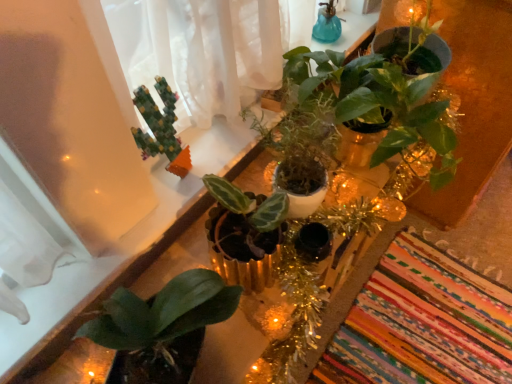
Describe the element at coordinates (384, 93) in the screenshot. I see `green matte plant at upper center, placed as the 1th houseplant when sorted from right to left` at that location.

Identify the location of blue glass vase at upper center. The height and width of the screenshot is (384, 512). (327, 28).

The width and height of the screenshot is (512, 384). Find the location of `green mosaic cactus at upper left, placed as the first houseplant when sorted from left to right`. green mosaic cactus at upper left, placed as the first houseplant when sorted from left to right is located at coordinates (160, 128).

Describe the element at coordinates (344, 124) in the screenshot. I see `green matte plant at center` at that location.

Find the location of `green matte plant at center, which appears as the second houseplant when viewed from the left`. green matte plant at center, which appears as the second houseplant when viewed from the left is located at coordinates (305, 128).

Is blue glass vase at upper center next to multicolored woven mat at lower right and touching it?

They are not placed beside each other.

Could you tell me if blue glass vase at upper center is facing multicolored woven mat at lower right?

No, blue glass vase at upper center is not turned towards multicolored woven mat at lower right.

From a real-world perspective, is blue glass vase at upper center under multicolored woven mat at lower right?

No, from a real-world perspective, blue glass vase at upper center is not beneath multicolored woven mat at lower right.

The image size is (512, 384). Find the location of `mat that appears below the blue glass vase at upper center (from a real-world perspective)`. mat that appears below the blue glass vase at upper center (from a real-world perspective) is located at coordinates (422, 324).

Consider the image. Is green matte plant at upper center, placed as the 1th houseplant when sorted from right to left, closer to the viewer compared to blue glass vase at upper center?

That is True.

Can you confirm if green matte plant at upper center, placed as the 1th houseplant when sorted from right to left, is thinner than blue glass vase at upper center?

No, green matte plant at upper center, placed as the 1th houseplant when sorted from right to left, is not thinner than blue glass vase at upper center.

Can you confirm if green matte plant at upper center, the 3th houseplant in the left-to-right sequence, is bigger than blue glass vase at upper center?

Yes.

Is blue glass vase at upper center smaller than green matte plant at center, the 2th houseplant positioned from the right?

Indeed, blue glass vase at upper center has a smaller size compared to green matte plant at center, the 2th houseplant positioned from the right.

From a real-world perspective, is blue glass vase at upper center on green matte plant at center, the 2th houseplant positioned from the right?

Yes, from a real-world perspective, blue glass vase at upper center is on top of green matte plant at center, the 2th houseplant positioned from the right.

Is blue glass vase at upper center wider or thinner than green matte plant at center, which appears as the second houseplant when viewed from the left?

Clearly, blue glass vase at upper center has less width compared to green matte plant at center, which appears as the second houseplant when viewed from the left.

Based on the photo, is green matte plant at center, the 2th houseplant positioned from the right, completely or partially inside blue glass vase at upper center?

No, green matte plant at center, the 2th houseplant positioned from the right, is not a part of blue glass vase at upper center.

Is green mosaic cactus at upper left, placed as the first houseplant when sorted from left to right, further to the viewer compared to green matte plant at center, which appears as the second houseplant when viewed from the left?

Yes, it is behind green matte plant at center, which appears as the second houseplant when viewed from the left.

Is green mosaic cactus at upper left, positioned as the third houseplant in right-to-left order, directly adjacent to green matte plant at center, the 2th houseplant positioned from the right?

They are not placed beside each other.

Based on the photo, is multicolored woven mat at lower right with blue glass vase at upper center?

No, multicolored woven mat at lower right is not in contact with blue glass vase at upper center.

Considering the points (420, 286) and (329, 36), which point is in front, point (420, 286) or point (329, 36)?

The point (329, 36) is more forward.

Is multicolored woven mat at lower right taller or shorter than blue glass vase at upper center?

multicolored woven mat at lower right is shorter than blue glass vase at upper center.

Considering the relative sizes of multicolored woven mat at lower right and blue glass vase at upper center in the image provided, is multicolored woven mat at lower right wider than blue glass vase at upper center?

Yes, multicolored woven mat at lower right is wider than blue glass vase at upper center.

Identify the location of mat that is on the right side of green mosaic cactus at upper left, placed as the first houseplant when sorted from left to right. (422, 324).

Is green mosaic cactus at upper left, placed as the first houseplant when sorted from left to right, turned away from multicolored woven mat at lower right?

No, green mosaic cactus at upper left, placed as the first houseplant when sorted from left to right, is not facing the opposite direction of multicolored woven mat at lower right.

Consider the image. Is green mosaic cactus at upper left, positioned as the third houseplant in right-to-left order, positioned before multicolored woven mat at lower right?

Yes, it is.

From the image's perspective, which is above, green mosaic cactus at upper left, placed as the first houseplant when sorted from left to right, or multicolored woven mat at lower right?

green mosaic cactus at upper left, placed as the first houseplant when sorted from left to right, appears higher in the image.

Is green matte plant at center further to the viewer compared to blue glass vase at upper center?

No, it is in front of blue glass vase at upper center.

Are green matte plant at center and blue glass vase at upper center far apart?

No, green matte plant at center is not far from blue glass vase at upper center.

Is green matte plant at center positioned with its back to blue glass vase at upper center?

No, green matte plant at center is not facing away from blue glass vase at upper center.

From the image's perspective, which one is positioned lower, green matte plant at center or blue glass vase at upper center?

green matte plant at center.

Identify the location of glass vase that is on the left side of multicolored woven mat at lower right. (327, 28).

Locate an element on the screen. Image resolution: width=512 pixels, height=384 pixels. glass vase above the green matte plant at upper center, placed as the 1th houseplant when sorted from right to left (from a real-world perspective) is located at coordinates (327, 28).

Looking at the image, which one is located closer to multicolored woven mat at lower right, blue glass vase at upper center or green matte plant at upper center, the 3th houseplant in the left-to-right sequence?

green matte plant at upper center, the 3th houseplant in the left-to-right sequence, is closer to multicolored woven mat at lower right.

When comparing their distances from green matte plant at center, does green mosaic cactus at upper left, placed as the first houseplant when sorted from left to right, or multicolored woven mat at lower right seem closer?

green mosaic cactus at upper left, placed as the first houseplant when sorted from left to right, is closer to green matte plant at center.

Which object lies nearer to the anchor point green matte plant at upper center, placed as the 1th houseplant when sorted from right to left, green mosaic cactus at upper left, positioned as the third houseplant in right-to-left order, or blue glass vase at upper center?

blue glass vase at upper center is closer to green matte plant at upper center, placed as the 1th houseplant when sorted from right to left.

Estimate the real-world distances between objects in this image. Which object is closer to green matte plant at upper center, the 3th houseplant in the left-to-right sequence, multicolored woven mat at lower right or blue glass vase at upper center?

Among the two, blue glass vase at upper center is located nearer to green matte plant at upper center, the 3th houseplant in the left-to-right sequence.

Looking at the image, which one is located closer to green matte plant at upper center, the 3th houseplant in the left-to-right sequence, multicolored woven mat at lower right or green matte plant at center, the 2th houseplant positioned from the right?

green matte plant at center, the 2th houseplant positioned from the right, lies closer to green matte plant at upper center, the 3th houseplant in the left-to-right sequence, than the other object.

Looking at this image, looking at the image, which one is located closer to blue glass vase at upper center, green matte plant at upper center, placed as the 1th houseplant when sorted from right to left, or green matte plant at center, the 2th houseplant positioned from the right?

The object closer to blue glass vase at upper center is green matte plant at upper center, placed as the 1th houseplant when sorted from right to left.

When comparing their distances from blue glass vase at upper center, does green matte plant at upper center, the 3th houseplant in the left-to-right sequence, or green mosaic cactus at upper left, positioned as the third houseplant in right-to-left order, seem further?

green mosaic cactus at upper left, positioned as the third houseplant in right-to-left order, is further to blue glass vase at upper center.

Looking at the image, which one is located further to blue glass vase at upper center, green matte plant at center, the 2th houseplant positioned from the right, or green matte plant at upper center, the 3th houseplant in the left-to-right sequence?

The object further to blue glass vase at upper center is green matte plant at center, the 2th houseplant positioned from the right.

Where is `houseplant between green mosaic cactus at upper left, placed as the first houseplant when sorted from left to right, and green matte plant at center`? The width and height of the screenshot is (512, 384). houseplant between green mosaic cactus at upper left, placed as the first houseplant when sorted from left to right, and green matte plant at center is located at coordinates (305, 128).

You are a GUI agent. You are given a task and a screenshot of the screen. Output one action in this format:
    pyautogui.click(x=<x>, y=<y>)
    Task: Click on the floral arrangement between green matte plant at center, which appears as the second houseplant when viewed from the left, and multicolored woven mat at lower right from top to bottom
    Image resolution: width=512 pixels, height=384 pixels.
    Given the screenshot: What is the action you would take?
    pyautogui.click(x=344, y=124)

Locate an element on the screen. houseplant between green mosaic cactus at upper left, placed as the first houseplant when sorted from left to right, and green matte plant at upper center, placed as the 1th houseplant when sorted from right to left, in the horizontal direction is located at coordinates (305, 128).

Locate an element on the screen. This screenshot has width=512, height=384. floral arrangement between green mosaic cactus at upper left, positioned as the third houseplant in right-to-left order, and green matte plant at upper center, placed as the 1th houseplant when sorted from right to left, in the horizontal direction is located at coordinates (344, 124).